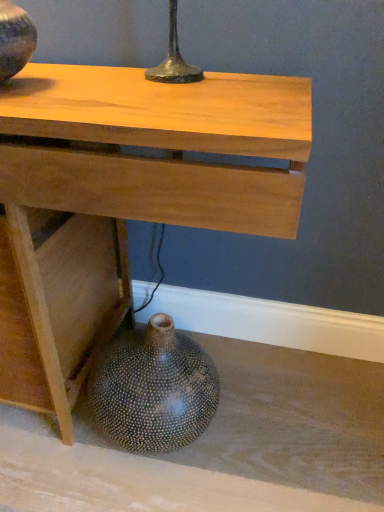
Question: Can you confirm if speckled ceramic vase at lower left, placed as the 1th vase when sorted from back to front, is thinner than matte black vase at upper left, placed as the 2th vase when sorted from back to front?

Choices:
 (A) yes
 (B) no

Answer: (B)

Question: Is speckled ceramic vase at lower left, the second vase in the left-to-right sequence, positioned before matte black vase at upper left, arranged as the first vase when viewed from the left?

Choices:
 (A) yes
 (B) no

Answer: (B)

Question: Could you tell me if speckled ceramic vase at lower left, placed as the 1th vase when sorted from back to front, is turned towards matte black vase at upper left, arranged as the first vase when viewed from the left?

Choices:
 (A) yes
 (B) no

Answer: (B)

Question: Does speckled ceramic vase at lower left, the 2th vase viewed from the top, have a greater width compared to matte black vase at upper left, which is the 2th vase from right to left?

Choices:
 (A) yes
 (B) no

Answer: (A)

Question: Is speckled ceramic vase at lower left, placed as the 1th vase when sorted from back to front, at the right side of matte black vase at upper left, arranged as the first vase when viewed from the top?

Choices:
 (A) no
 (B) yes

Answer: (B)

Question: Is speckled ceramic vase at lower left, the second vase positioned from the front, oriented away from matte black vase at upper left, placed as the 2th vase when sorted from back to front?

Choices:
 (A) yes
 (B) no

Answer: (B)

Question: Does matte black vase at upper left, arranged as the first vase when viewed from the front, lie in front of speckled ceramic vase at lower left, arranged as the first vase when ordered from the bottom?

Choices:
 (A) yes
 (B) no

Answer: (A)

Question: Does matte black vase at upper left, arranged as the first vase when viewed from the top, touch speckled ceramic vase at lower left, the second vase positioned from the front?

Choices:
 (A) no
 (B) yes

Answer: (A)

Question: From a real-world perspective, does matte black vase at upper left, the second vase when ordered from bottom to top, stand above speckled ceramic vase at lower left, placed as the 1th vase when sorted from back to front?

Choices:
 (A) yes
 (B) no

Answer: (A)

Question: Is matte black vase at upper left, arranged as the first vase when viewed from the top, bigger than speckled ceramic vase at lower left, arranged as the first vase when ordered from the bottom?

Choices:
 (A) no
 (B) yes

Answer: (A)

Question: Could you tell me if matte black vase at upper left, placed as the 2th vase when sorted from back to front, is facing speckled ceramic vase at lower left, placed as the 1th vase when sorted from back to front?

Choices:
 (A) yes
 (B) no

Answer: (B)

Question: Is matte black vase at upper left, arranged as the first vase when viewed from the top, shorter than speckled ceramic vase at lower left, arranged as the first vase when ordered from the bottom?

Choices:
 (A) yes
 (B) no

Answer: (A)

Question: Can speckled ceramic vase at lower left, placed as the 1th vase when sorted from back to front, be found inside natural wood table at center?

Choices:
 (A) no
 (B) yes

Answer: (B)